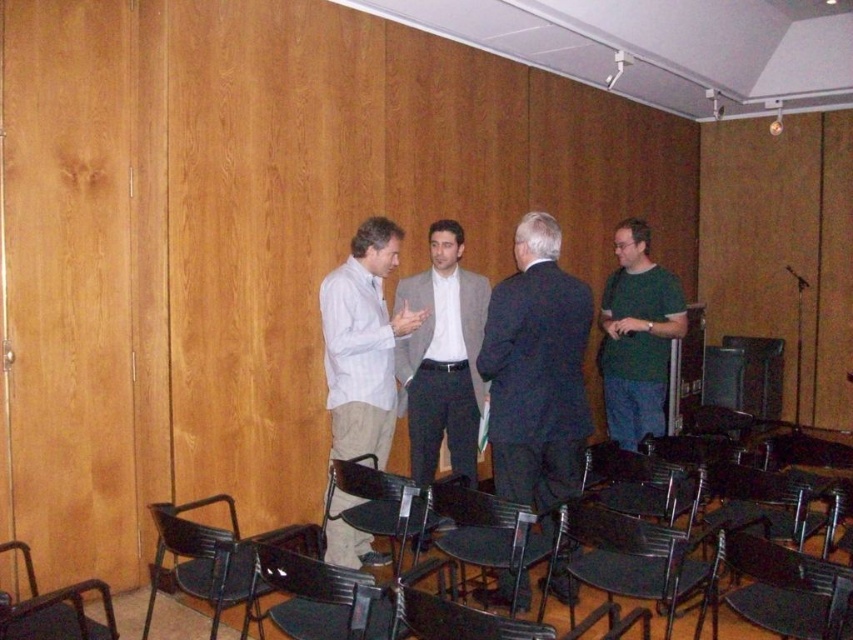
You are a tailor who needs to determine which garment has a larger width to adjust a pattern accordingly. Looking at the light beige cotton shirt at center and the gray suit at center, which one has a greater width?

The light beige cotton shirt at center has a greater width than the gray suit at center.

You are standing in the conference room and need to find the gray suit at center. According to the scene description, where should you look relative to the cluster of black chairs arranged in a semi circle?

The gray suit at center is located at point (x=442, y=356), which is near the cluster of black chairs arranged in a semi circle. Since the chairs are arranged in a semi circle, the gray suit at center is likely positioned at the center of the semi circle formation.